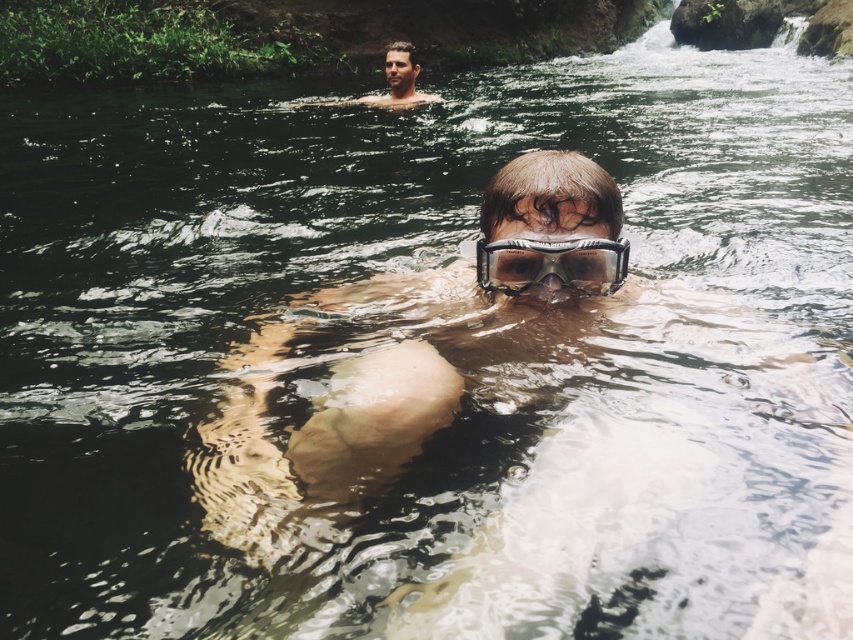
You are a lifeguard observing the scene. You notice the clear plastic goggles at center. Based on their position, can you determine if they are closer to the foreground swimmer or the background swimmer?

The clear plastic goggles at center are located at point coordinates that place them closer to the foreground swimmer since they are positioned at the center of the image, which aligns with the foreground swimmer being in the foreground.

You are a photographer trying to capture both the transparent plastic goggles at center and the smooth skin man at upper center in a single frame. Which object should you focus on first to ensure both are in the frame?

You should focus on the smooth skin man at upper center first because the transparent plastic goggles at center occupies less space and will naturally fit within the frame when the larger object is centered.